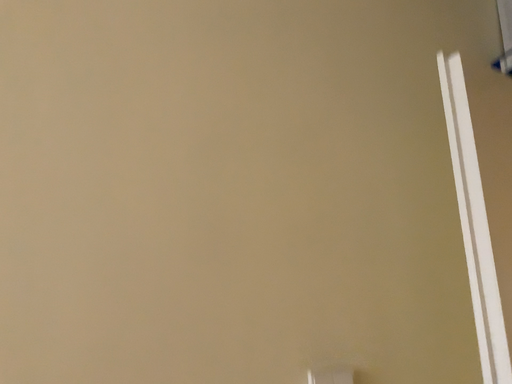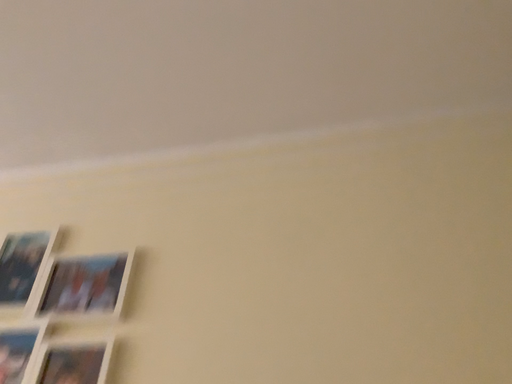
Question: How did the camera likely rotate when shooting the video?

Choices:
 (A) rotated left
 (B) rotated right

Answer: (A)